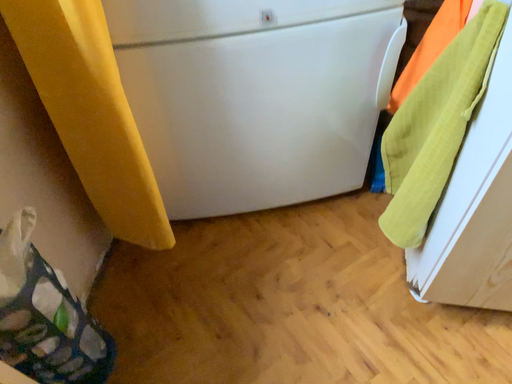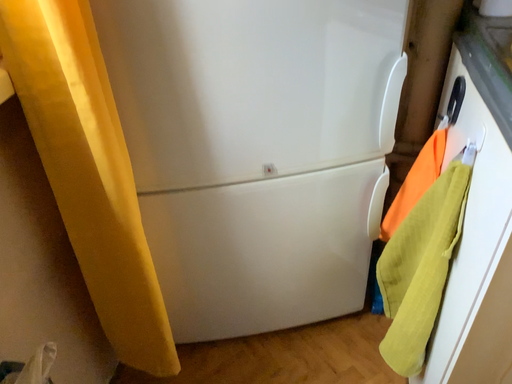
Question: How did the camera likely rotate when shooting the video?

Choices:
 (A) rotated downward
 (B) rotated upward

Answer: (B)